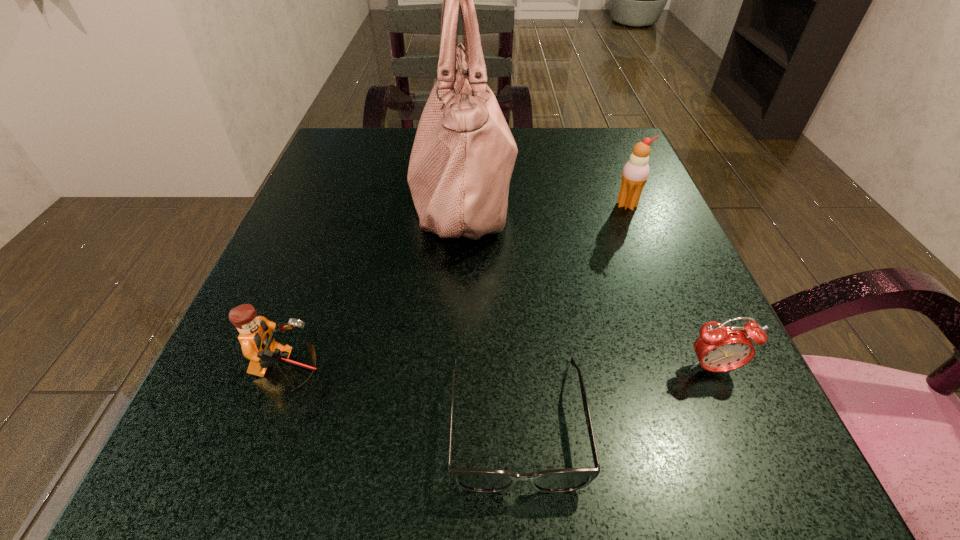
Image resolution: width=960 pixels, height=540 pixels. I want to click on handbag, so click(x=463, y=155).

Locate an element on the screen. icecream is located at coordinates (635, 173).

At what (x,y) coordinates should I click in order to perform the action: click on the leftmost object. Please return your answer as a coordinate pair (x, y). The height and width of the screenshot is (540, 960). Looking at the image, I should click on (256, 338).

You are a GUI agent. You are given a task and a screenshot of the screen. Output one action in this format:
    pyautogui.click(x=<x>, y=<y>)
    Task: Click on the alarm clock
    
    Given the screenshot: What is the action you would take?
    pyautogui.click(x=719, y=348)

At what (x,y) coordinates should I click in order to perform the action: click on the shortest object. Please return your answer as a coordinate pair (x, y). Looking at the image, I should click on (481, 480).

Where is `free space located 0.170m at the front of the tallest object with handles`? Image resolution: width=960 pixels, height=540 pixels. free space located 0.170m at the front of the tallest object with handles is located at coordinates (598, 195).

The image size is (960, 540). In order to click on vacant area located at the front with a straw on the icecream in this screenshot , I will do `click(658, 282)`.

Where is `free space located holding a crossbow in the hands of the Lego`? The height and width of the screenshot is (540, 960). free space located holding a crossbow in the hands of the Lego is located at coordinates (523, 372).

I want to click on free location located on the face of the alarm clock, so click(x=759, y=477).

Image resolution: width=960 pixels, height=540 pixels. Find the location of `object present at the far edge`. object present at the far edge is located at coordinates (463, 155).